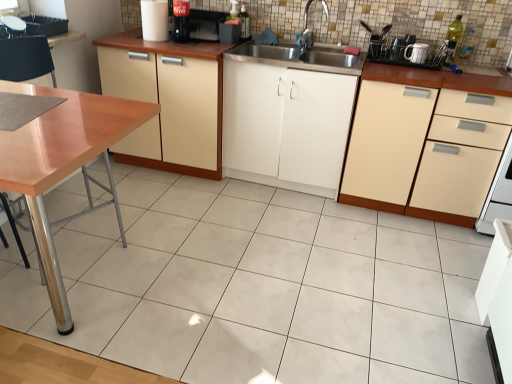
The height and width of the screenshot is (384, 512). Describe the element at coordinates (401, 47) in the screenshot. I see `white ceramic mug at upper right, which appears as the first appliance when viewed from the right` at that location.

Describe the element at coordinates (416, 53) in the screenshot. Image resolution: width=512 pixels, height=384 pixels. I see `white glossy mug at upper right` at that location.

Measure the distance between point [304,33] and camera.

The depth of point [304,33] is 2.79 meters.

Where is `white matte cabinet at center, placed as the second cabinetry when sorted from left to right`? The width and height of the screenshot is (512, 384). white matte cabinet at center, placed as the second cabinetry when sorted from left to right is located at coordinates (286, 126).

Where is `black plastic dish rack at upper right, the 2th appliance when ordered from right to left`? black plastic dish rack at upper right, the 2th appliance when ordered from right to left is located at coordinates (409, 52).

Which is in front, beige wood cabinet at center, arranged as the third cabinetry when viewed from the right, or white ceramic mug at upper right, the fourth appliance in the left-to-right sequence?

beige wood cabinet at center, arranged as the third cabinetry when viewed from the right, is more forward.

From the image's perspective, relative to white ceramic mug at upper right, the fourth appliance in the left-to-right sequence, is beige wood cabinet at center, arranged as the third cabinetry when viewed from the right, above or below?

Clearly, from the image's perspective, beige wood cabinet at center, arranged as the third cabinetry when viewed from the right, is below white ceramic mug at upper right, the fourth appliance in the left-to-right sequence.

Is beige wood cabinet at center, which is the 1th cabinetry in left-to-right order, to the left of white ceramic mug at upper right, the fourth appliance in the left-to-right sequence, from the viewer's perspective?

Yes, beige wood cabinet at center, which is the 1th cabinetry in left-to-right order, is to the left of white ceramic mug at upper right, the fourth appliance in the left-to-right sequence.

Which object is thinner, white glossy mug at upper right or white glossy coffee cup at upper left, acting as the first appliance starting from the left?

white glossy mug at upper right.

Relative to white glossy coffee cup at upper left, acting as the first appliance starting from the left, is white glossy mug at upper right in front or behind?

Visually, white glossy mug at upper right is located behind white glossy coffee cup at upper left, acting as the first appliance starting from the left.

How distant is white glossy mug at upper right from white glossy coffee cup at upper left, which is counted as the 4th appliance, starting from the right?

white glossy mug at upper right is 2.36 meters away from white glossy coffee cup at upper left, which is counted as the 4th appliance, starting from the right.

Does white glossy mug at upper right have a larger size compared to white glossy coffee cup at upper left, acting as the first appliance starting from the left?

Incorrect, white glossy mug at upper right is not larger than white glossy coffee cup at upper left, acting as the first appliance starting from the left.

From the image's perspective, does white ceramic mug at upper right, which appears as the first appliance when viewed from the right, appear lower than beige wood cabinet at center, which is the 1th cabinetry in left-to-right order?

No, from the image's perspective, white ceramic mug at upper right, which appears as the first appliance when viewed from the right, is not beneath beige wood cabinet at center, which is the 1th cabinetry in left-to-right order.

Which object is wider, white ceramic mug at upper right, which appears as the first appliance when viewed from the right, or beige wood cabinet at center, which is the 1th cabinetry in left-to-right order?

beige wood cabinet at center, which is the 1th cabinetry in left-to-right order.

In the image, is white ceramic mug at upper right, which appears as the first appliance when viewed from the right, positioned in front of or behind beige wood cabinet at center, which is the 1th cabinetry in left-to-right order?

Clearly, white ceramic mug at upper right, which appears as the first appliance when viewed from the right, is behind beige wood cabinet at center, which is the 1th cabinetry in left-to-right order.

Considering the positions of point (166, 14) and point (151, 71), is point (166, 14) closer or farther from the camera than point (151, 71)?

Point (166, 14) is farther from the camera than point (151, 71).

Starting from the white glossy cup at upper center, which is the 2th appliance in left-to-right order, which cabinetry is the 1st one to the right? Please provide its 2D coordinates.

[(168, 110)]

Choose the correct answer: Is white glossy cup at upper center, which is the 2th appliance in left-to-right order, inside beige wood cabinet at center, arranged as the third cabinetry when viewed from the right, or outside it?

white glossy cup at upper center, which is the 2th appliance in left-to-right order, exists outside the volume of beige wood cabinet at center, arranged as the third cabinetry when viewed from the right.

Considering the relative positions of white glossy cup at upper center, which is the 2th appliance in left-to-right order, and beige wood cabinet at center, which is the 1th cabinetry in left-to-right order, in the image provided, is white glossy cup at upper center, which is the 2th appliance in left-to-right order, to the right of beige wood cabinet at center, which is the 1th cabinetry in left-to-right order, from the viewer's perspective?

Incorrect, white glossy cup at upper center, which is the 2th appliance in left-to-right order, is not on the right side of beige wood cabinet at center, which is the 1th cabinetry in left-to-right order.

Considering the sizes of objects wooden table at left and white glossy cup at upper center, arranged as the third appliance when viewed from the right, in the image provided, who is wider, wooden table at left or white glossy cup at upper center, arranged as the third appliance when viewed from the right,?

wooden table at left.

Would you say wooden table at left contains white glossy cup at upper center, which is the 2th appliance in left-to-right order?

No, white glossy cup at upper center, which is the 2th appliance in left-to-right order, is not a part of wooden table at left.

From the wooden table at left, count 4th appliances backward and point to it. Please provide its 2D coordinates.

[(155, 20)]

Could you tell me if beige matte cabinet at right, the 3th cabinetry positioned from the left, is facing white matte cabinet at center, placed as the second cabinetry when sorted from left to right?

No, beige matte cabinet at right, the 3th cabinetry positioned from the left, is not aimed at white matte cabinet at center, placed as the second cabinetry when sorted from left to right.

What's the angular difference between beige matte cabinet at right, which is the 1th cabinetry from right to left, and white matte cabinet at center, placed as the second cabinetry when sorted from left to right,'s facing directions?

There is a 3.65e-05-degree angle between the facing directions of beige matte cabinet at right, which is the 1th cabinetry from right to left, and white matte cabinet at center, placed as the second cabinetry when sorted from left to right.

Is point (406, 193) closer to camera compared to point (242, 165)?

Yes, point (406, 193) is in front of point (242, 165).

Can you confirm if beige matte cabinet at right, which is the 1th cabinetry from right to left, is smaller than white matte cabinet at center, placed as the second cabinetry when sorted from left to right?

Incorrect, beige matte cabinet at right, which is the 1th cabinetry from right to left, is not smaller in size than white matte cabinet at center, placed as the second cabinetry when sorted from left to right.

Could white glossy coffee cup at upper left, which is counted as the 4th appliance, starting from the right, be considered to be inside white ceramic mug at upper right, which appears as the first appliance when viewed from the right?

No, white glossy coffee cup at upper left, which is counted as the 4th appliance, starting from the right, is located outside of white ceramic mug at upper right, which appears as the first appliance when viewed from the right.

From the image's perspective, is white ceramic mug at upper right, the fourth appliance in the left-to-right sequence, beneath white glossy coffee cup at upper left, which is counted as the 4th appliance, starting from the right?

Yes, from the image's perspective, white ceramic mug at upper right, the fourth appliance in the left-to-right sequence, is beneath white glossy coffee cup at upper left, which is counted as the 4th appliance, starting from the right.

Is white ceramic mug at upper right, which appears as the first appliance when viewed from the right, not near white glossy coffee cup at upper left, which is counted as the 4th appliance, starting from the right?

Yes, white ceramic mug at upper right, which appears as the first appliance when viewed from the right, is far from white glossy coffee cup at upper left, which is counted as the 4th appliance, starting from the right.

From the white ceramic mug at upper right, which appears as the first appliance when viewed from the right, count the 2nd cabinetry to the left and point to it. Please provide its 2D coordinates.

[(168, 110)]

The image size is (512, 384). There is a white glossy mug at upper right. In order to click on the 3rd appliance above it (from the image's perspective) in this screenshot , I will do `click(14, 25)`.

Looking at the image, which one is located further to beige matte cabinet at right, which is the 1th cabinetry from right to left, white glossy cup at upper center, arranged as the third appliance when viewed from the right, or black plastic dish rack at upper right, acting as the third appliance starting from the left?

white glossy cup at upper center, arranged as the third appliance when viewed from the right, lies further to beige matte cabinet at right, which is the 1th cabinetry from right to left, than the other object.

Estimate the real-world distances between objects in this image. Which object is closer to wooden countertop at upper left, white glossy coffee cup at upper left, acting as the first appliance starting from the left, or silver metallic faucet at upper center?

Based on the image, white glossy coffee cup at upper left, acting as the first appliance starting from the left, appears to be nearer to wooden countertop at upper left.

Based on their spatial positions, is beige wood cabinet at center, which is the 1th cabinetry in left-to-right order, or wooden table at left closer to beige matte cabinet at right, which is the 1th cabinetry from right to left?

beige wood cabinet at center, which is the 1th cabinetry in left-to-right order, is positioned closer to the anchor beige matte cabinet at right, which is the 1th cabinetry from right to left.

Estimate the real-world distances between objects in this image. Which object is closer to wooden countertop at upper left, white matte cabinet at center, which is the 2th cabinetry in right-to-left order, or white ceramic mug at upper right, the fourth appliance in the left-to-right sequence?

white matte cabinet at center, which is the 2th cabinetry in right-to-left order, is closer to wooden countertop at upper left.

From the image, which object appears to be farther from white ceramic mug at upper right, the fourth appliance in the left-to-right sequence, silver metallic faucet at upper center or black plastic dish rack at upper right, the 2th appliance when ordered from right to left?

Based on the image, silver metallic faucet at upper center appears to be further to white ceramic mug at upper right, the fourth appliance in the left-to-right sequence.

Considering their positions, is white glossy cup at upper center, arranged as the third appliance when viewed from the right, positioned closer to silver metallic faucet at upper center than beige wood cabinet at center, which is the 1th cabinetry in left-to-right order?

white glossy cup at upper center, arranged as the third appliance when viewed from the right, is positioned closer to the anchor silver metallic faucet at upper center.

Considering their positions, is white ceramic mug at upper right, which appears as the first appliance when viewed from the right, positioned further to white matte cabinet at center, which is the 2th cabinetry in right-to-left order, than silver metallic faucet at upper center?

white ceramic mug at upper right, which appears as the first appliance when viewed from the right, lies further to white matte cabinet at center, which is the 2th cabinetry in right-to-left order, than the other object.

When comparing their distances from white glossy cup at upper center, arranged as the third appliance when viewed from the right, does black plastic dish rack at upper right, acting as the third appliance starting from the left, or white matte cabinet at center, placed as the second cabinetry when sorted from left to right, seem further?

black plastic dish rack at upper right, acting as the third appliance starting from the left, is further to white glossy cup at upper center, arranged as the third appliance when viewed from the right.

Identify the location of counter top situated between white glossy coffee cup at upper left, which is counted as the 4th appliance, starting from the right, and beige wood cabinet at center, arranged as the third cabinetry when viewed from the right, from left to right. (65, 38).

Where is `kitchen appliance between wooden table at left and beige matte cabinet at right, which is the 1th cabinetry from right to left`? The image size is (512, 384). kitchen appliance between wooden table at left and beige matte cabinet at right, which is the 1th cabinetry from right to left is located at coordinates (416, 53).

Find the location of a particular element. This screenshot has height=384, width=512. appliance located between wooden table at left and wooden countertop at upper left in the depth direction is located at coordinates (14, 25).

Locate an element on the screen. The height and width of the screenshot is (384, 512). table located between white glossy coffee cup at upper left, acting as the first appliance starting from the left, and white ceramic mug at upper right, which appears as the first appliance when viewed from the right, in the left-right direction is located at coordinates (63, 164).